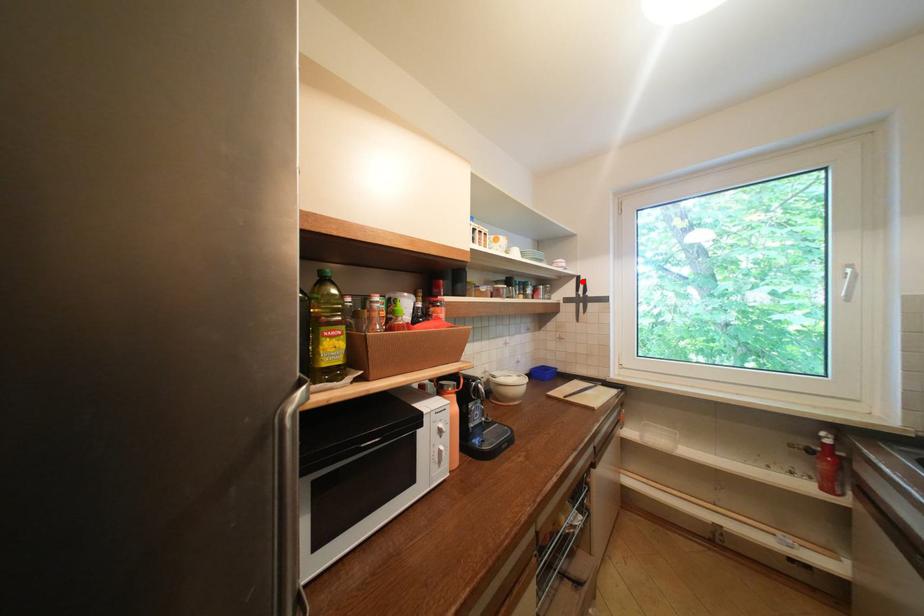
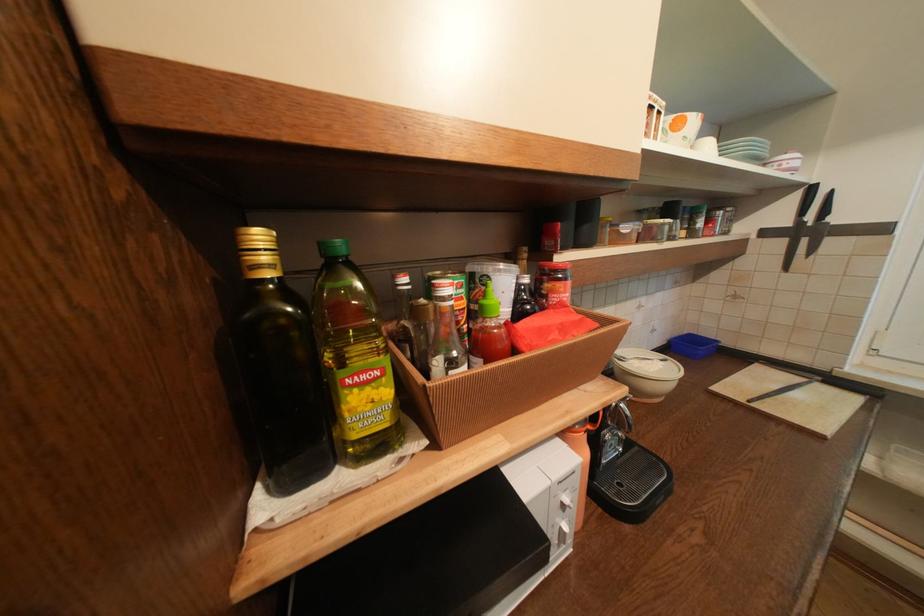
Find the pixel in the second image that matches the highlighted location in the first image.

(807, 196)